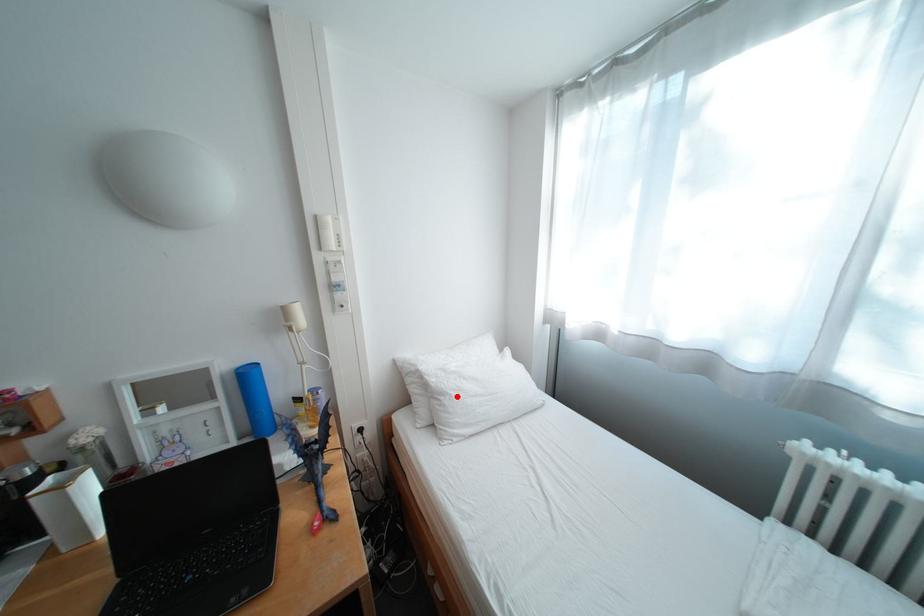
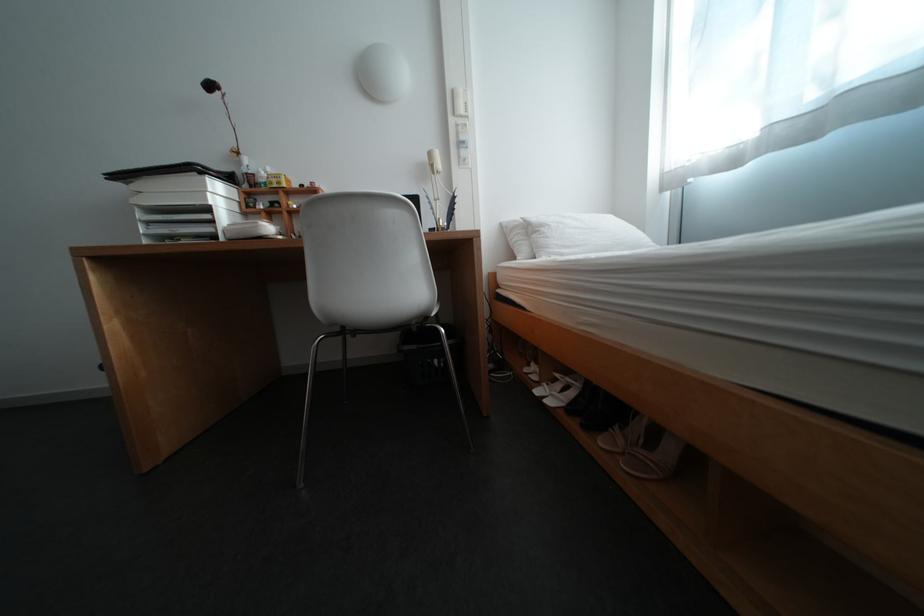
Find the pixel in the second image that matches the highlighted location in the first image.

(555, 228)